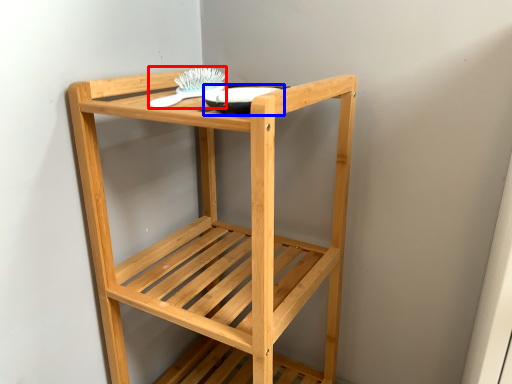
Question: Which object appears farthest to the camera in this image, brush (highlighted by a red box) or glass bowl (highlighted by a blue box)?

Choices:
 (A) brush
 (B) glass bowl

Answer: (A)